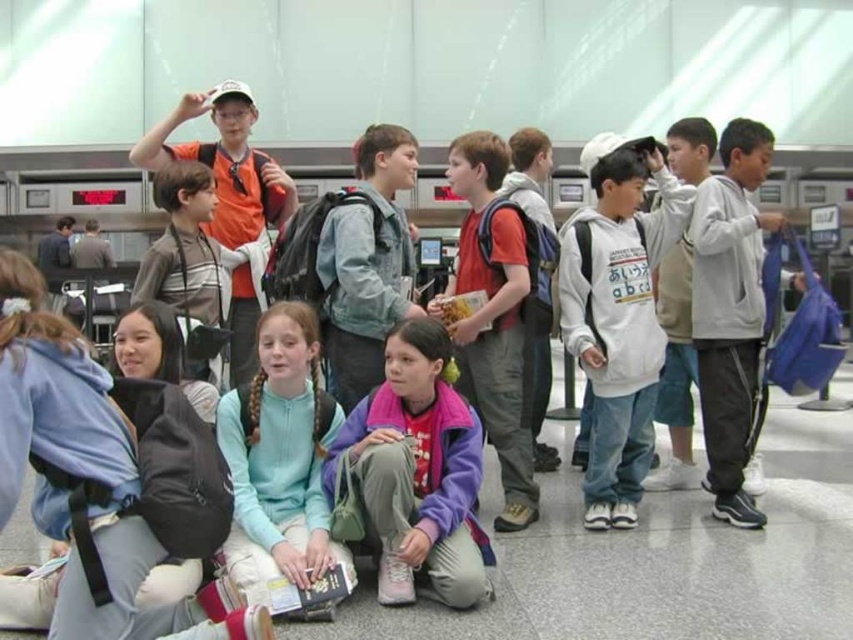
Can you confirm if purple fleece jacket at center is thinner than denim jacket at center?

No.

Does point (471, 600) come in front of point (387, 179)?

That is True.

Consider the image. Who is more distant from viewer, (410,528) or (384,221)?

The point (384,221) is more distant.

The image size is (853, 640). In order to click on purple fleece jacket at center in this screenshot , I will do `click(416, 474)`.

Which of these two, white cotton hoodie at center or red matte backpack at center, stands shorter?

With less height is white cotton hoodie at center.

Is white cotton hoodie at center taller than red matte backpack at center?

In fact, white cotton hoodie at center may be shorter than red matte backpack at center.

The image size is (853, 640). I want to click on white cotton hoodie at center, so click(x=618, y=317).

Identify the location of white cotton hoodie at center. (618, 317).

The height and width of the screenshot is (640, 853). What are the coordinates of `purple fleece jacket at center` in the screenshot? It's located at (416, 474).

Who is taller, purple fleece jacket at center or gray fleece hoodie at right?

gray fleece hoodie at right is taller.

The image size is (853, 640). I want to click on purple fleece jacket at center, so click(x=416, y=474).

This screenshot has height=640, width=853. Identify the location of purple fleece jacket at center. (416, 474).